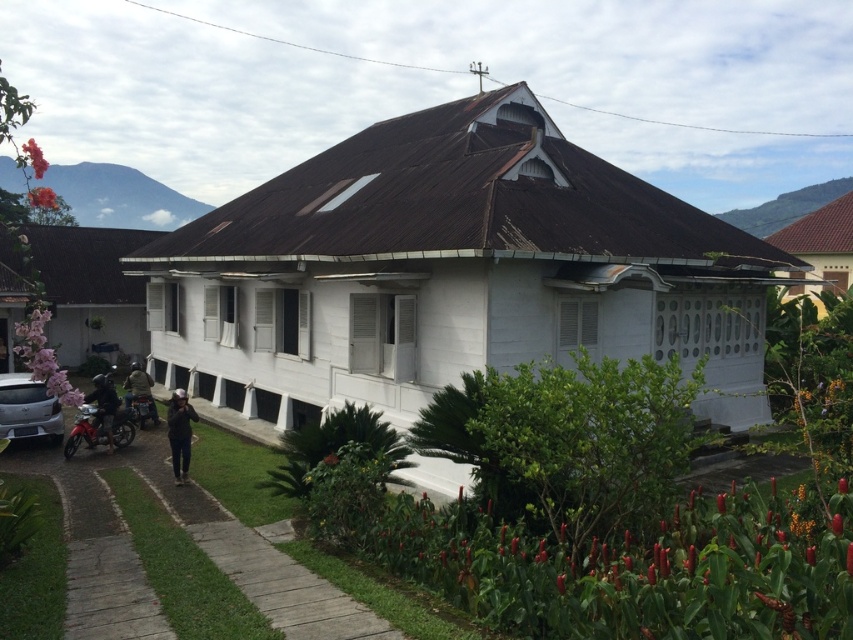
You are standing in front of the traditional house and want to pick up the dark blue helmet at lower left. Based on its coordinates, where exactly is it located?

The dark blue helmet at lower left is located at point (103, 404).

You are standing in the front yard of the house and want to place a small potted plant. The dark gray fabric at center is located at point (178, 433). Where should you place the potted plant so it is directly in front of the dark gray fabric at center?

Place the potted plant at point (178, 433) to position it directly in front of the dark gray fabric at center.

You are standing at the entrance of the house and want to park your metallic red motorcycle at lower left. Where exactly should you position it?

The metallic red motorcycle at lower left should be positioned at point (86,429).